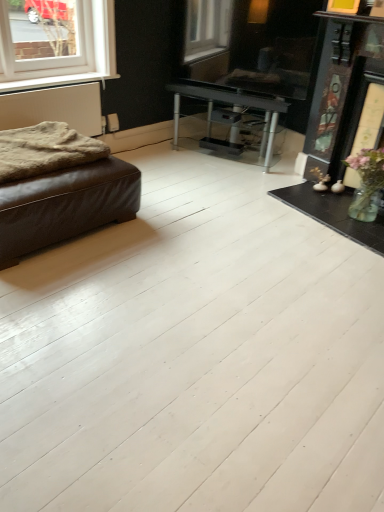
Question: Does white plastic window at upper left contain white textured radiator at left?

Choices:
 (A) no
 (B) yes

Answer: (A)

Question: Is white plastic window at upper left behind white textured radiator at left?

Choices:
 (A) no
 (B) yes

Answer: (A)

Question: Is white plastic window at upper left located outside white textured radiator at left?

Choices:
 (A) no
 (B) yes

Answer: (B)

Question: From a real-world perspective, is white plastic window at upper left over white textured radiator at left?

Choices:
 (A) no
 (B) yes

Answer: (B)

Question: From the image's perspective, is white plastic window at upper left on top of white textured radiator at left?

Choices:
 (A) no
 (B) yes

Answer: (B)

Question: Is white plastic window at upper left next to white textured radiator at left and touching it?

Choices:
 (A) no
 (B) yes

Answer: (A)

Question: Is the depth of brown leather ottoman at left greater than that of white plastic window at upper left?

Choices:
 (A) no
 (B) yes

Answer: (A)

Question: Can you confirm if brown leather ottoman at left is smaller than white plastic window at upper left?

Choices:
 (A) yes
 (B) no

Answer: (B)

Question: Is the position of brown leather ottoman at left less distant than that of white plastic window at upper left?

Choices:
 (A) no
 (B) yes

Answer: (B)

Question: From the image's perspective, does brown leather ottoman at left appear lower than white plastic window at upper left?

Choices:
 (A) yes
 (B) no

Answer: (A)

Question: Is brown leather ottoman at left positioned with its back to white plastic window at upper left?

Choices:
 (A) no
 (B) yes

Answer: (A)

Question: Can you confirm if brown leather ottoman at left is wider than white plastic window at upper left?

Choices:
 (A) no
 (B) yes

Answer: (B)

Question: From a real-world perspective, does white textured radiator at left stand above fuzzy woolen blanket at left?

Choices:
 (A) no
 (B) yes

Answer: (A)